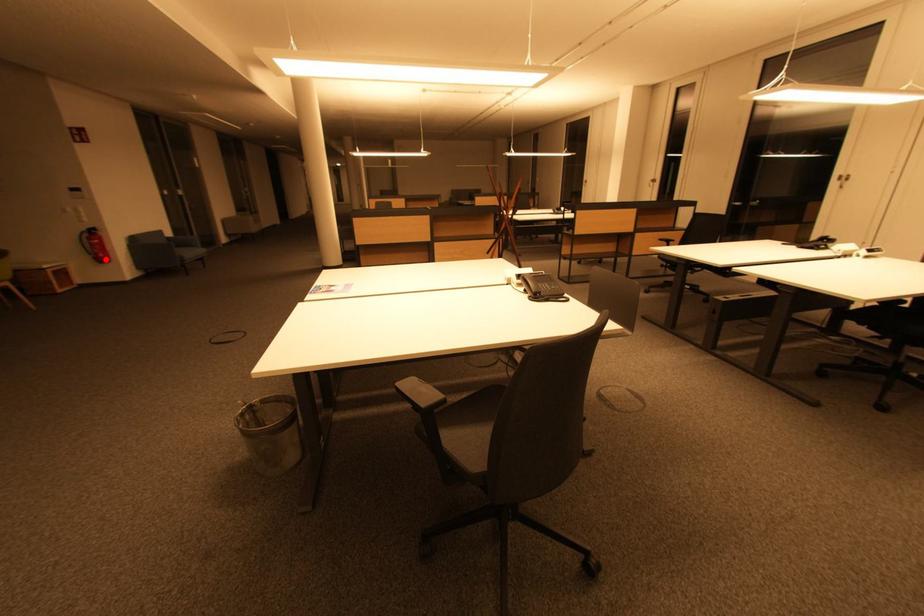
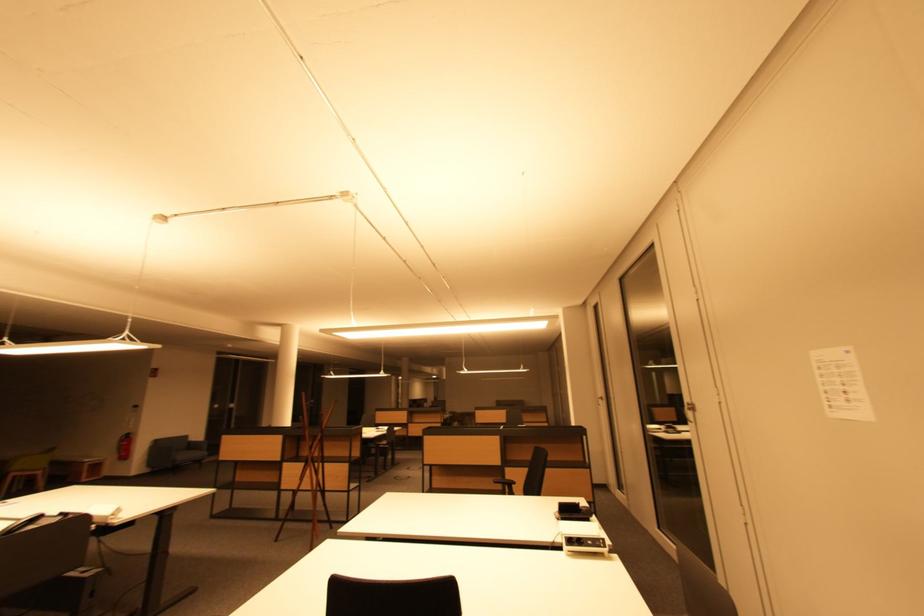
Question: I am providing you with two images of the same scene from different viewpoints. A red point is marked on the first image. Is the red point's position out of view in image 2?

Choices:
 (A) Yes
 (B) No

Answer: (B)